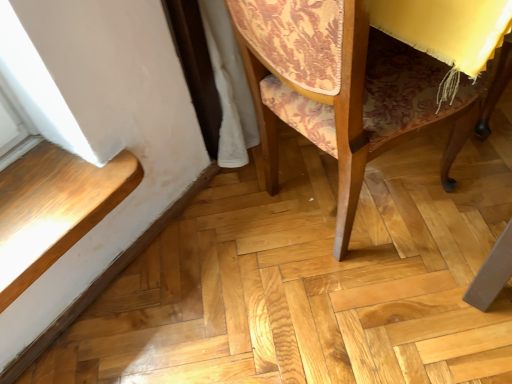
The width and height of the screenshot is (512, 384). What are the coordinates of `vacant space underneath wooden floor at lower left (from a real-world perspective)` in the screenshot? It's located at (117, 260).